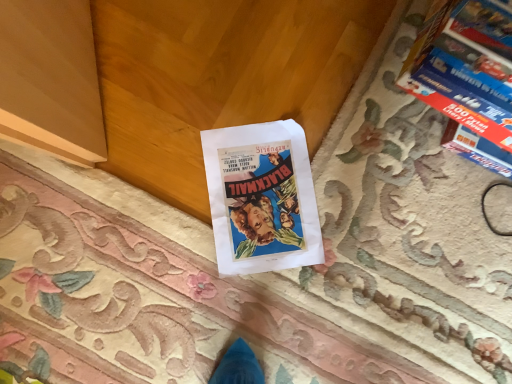
Where is `blank space to the left of vintage paper poster at center`? blank space to the left of vintage paper poster at center is located at coordinates (179, 138).